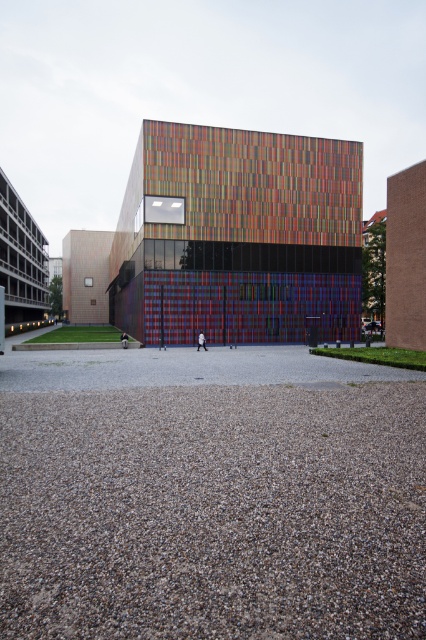
You are a drone operator trying to land a drone on the gray gravel at lower center. The drone has a GPS coordinate system where the bottom left corner of the image is the origin point. The coordinates are given as a percentage of the image width and height. What are the coordinates where you should aim to land the drone?

The gray gravel at lower center is located at coordinates point (213, 513). So you should aim for those coordinates to land the drone there.

You are standing on the gray gravel at lower center and want to see the top of the multicolored glass building at center. Can you see it without moving your position?

The gray gravel at lower center is not as tall as the multicolored glass building at center, so yes, you can see the top of the multicolored glass building at center from your current position on the gray gravel at lower center.